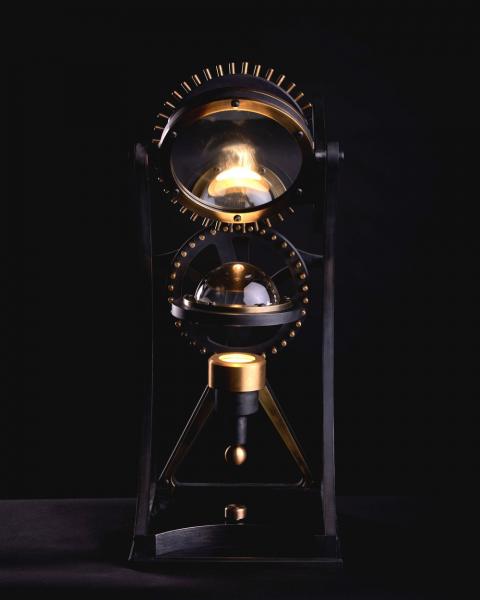
Where is `light inside top sphere`? light inside top sphere is located at coordinates (236, 172).